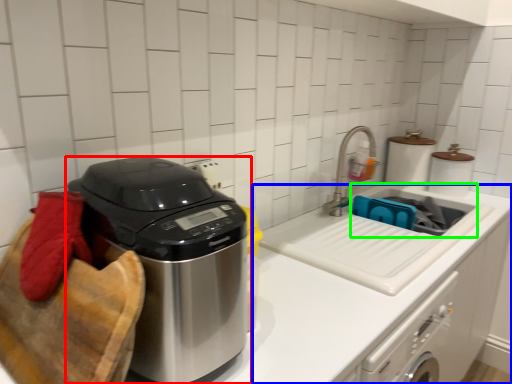
Question: Based on their relative distances, which object is nearer to home appliance (highlighted by a red box)? Choose from counter (highlighted by a blue box) and sink (highlighted by a green box).

Choices:
 (A) counter
 (B) sink

Answer: (A)